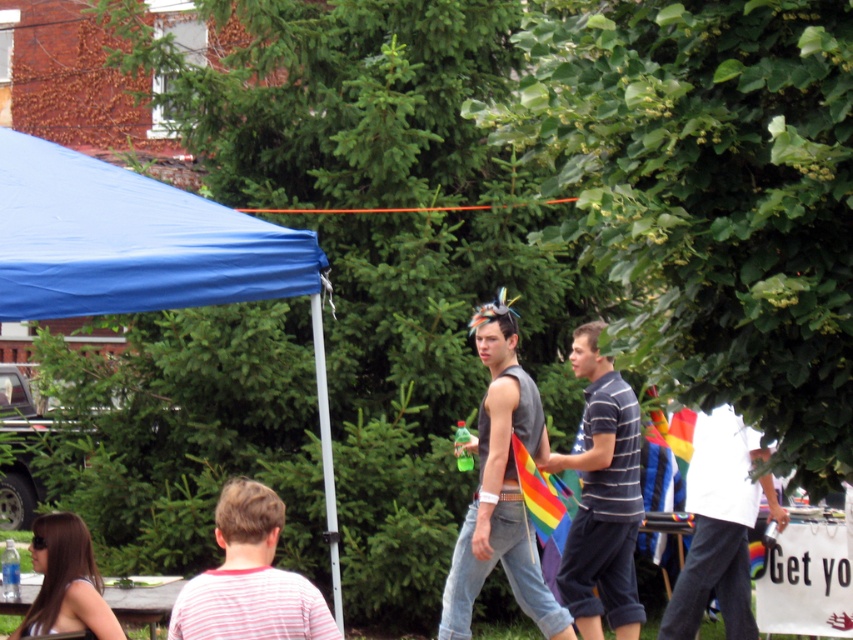
You are standing at the center of the scene and want to place a small potted plant between the white cotton shirt at right and the wooden picnic table at lower left. Based on their positions, where should you place the plant?

The white cotton shirt at right is located above the wooden picnic table at lower left, so you should place the plant between them in the middle area below the shirt and above the table.

You are a photographer trying to capture a photo of the blue fabric tent at upper left and the gray sleeveless shirt at center. You want to ensure both are fully visible in the frame. Which object should you adjust your camera angle to prioritize if you can only focus on one due to limited space?

The blue fabric tent at upper left is wider than the gray sleeveless shirt at center, so you should prioritize adjusting your camera angle to include the blue fabric tent at upper left first, as it occupies more space in the frame.

You are standing at the edge of the scene and want to take a photo of both the gray sleeveless shirt at center and the wooden picnic table at lower left. Which object should you focus on first to ensure both are in the frame?

The gray sleeveless shirt at center is located above the wooden picnic table at lower left, so you should focus on the wooden picnic table at lower left first to ensure both are in the frame.